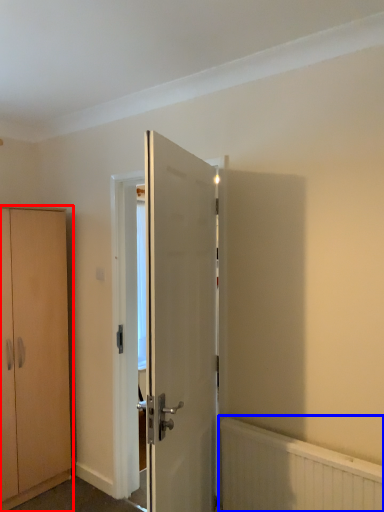
Question: Among these objects, which one is nearest to the camera, cabinetry (highlighted by a red box) or radiator (highlighted by a blue box)?

Choices:
 (A) cabinetry
 (B) radiator

Answer: (B)